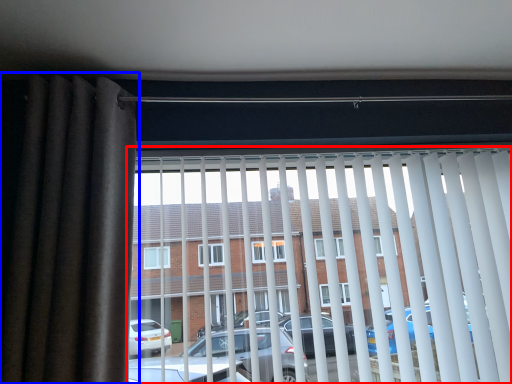
Question: Which object appears closest to the camera in this image, window blind (highlighted by a red box) or curtain (highlighted by a blue box)?

Choices:
 (A) window blind
 (B) curtain

Answer: (B)